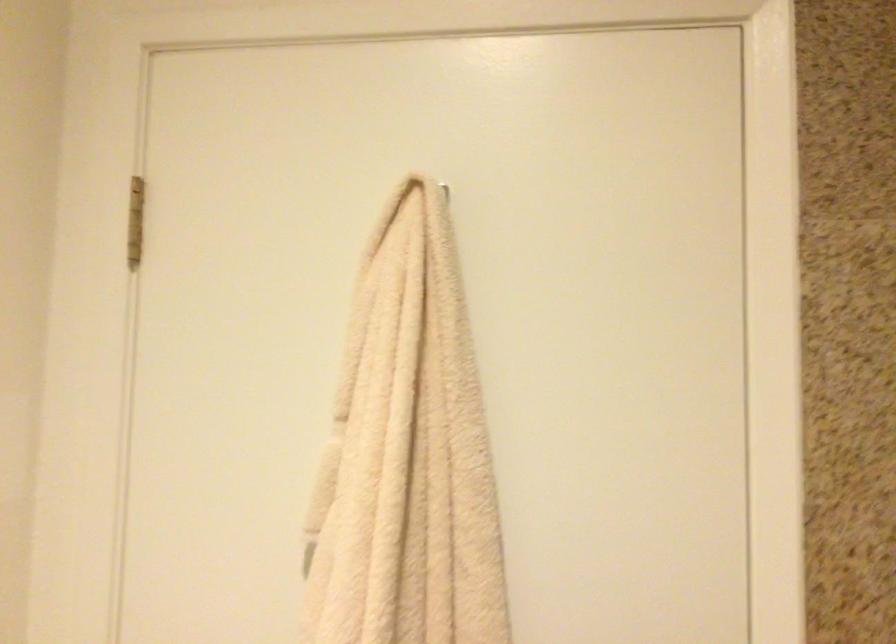
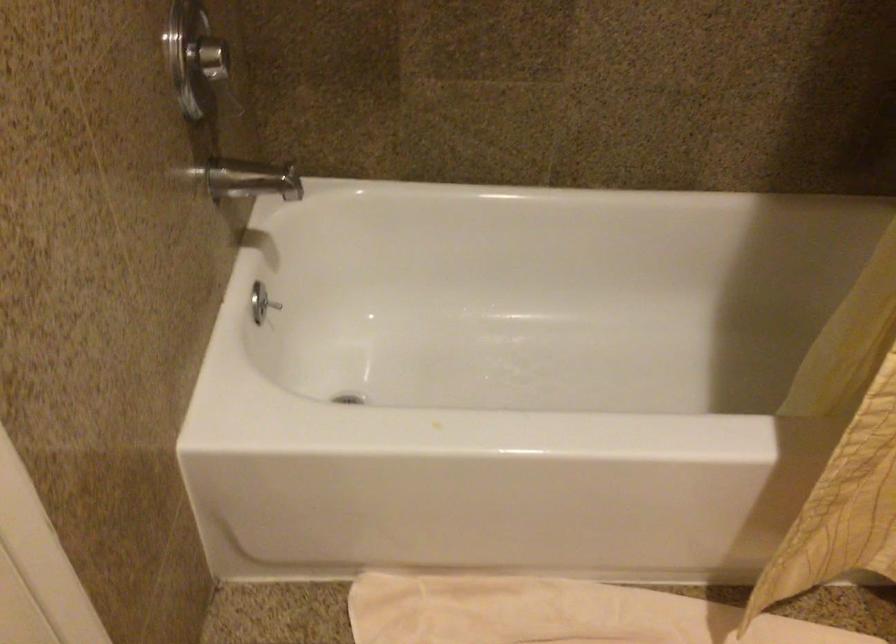
First-person continuous shooting, in which direction is the camera rotating?

The rotation direction of the camera is right-down.